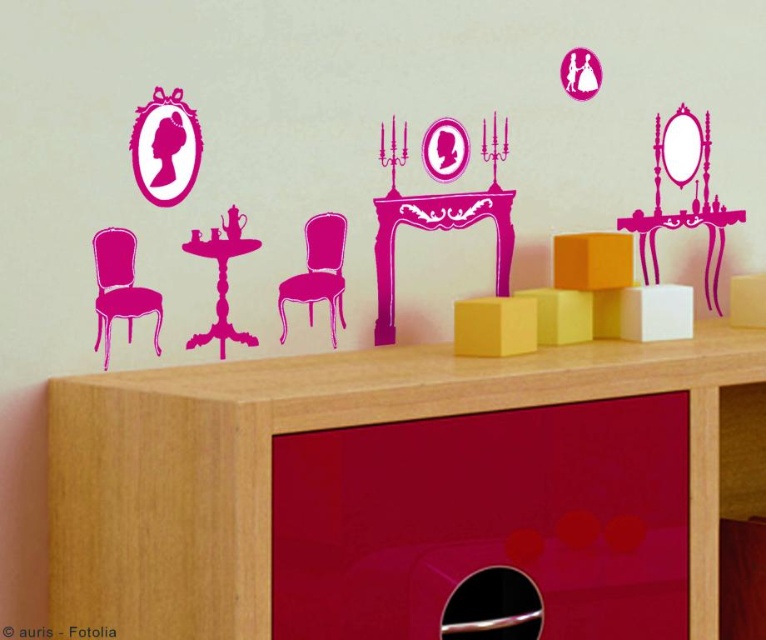
Which is above, pink glossy chair at center or pink glossy table at center?

pink glossy chair at center is higher up.

Is point (326, 268) less distant than point (182, 244)?

That is False.

Where is `pink glossy chair at center`? Image resolution: width=766 pixels, height=640 pixels. pink glossy chair at center is located at coordinates (318, 273).

Between wooden dresser at lower center and matte pink chair at left, which one is positioned lower?

wooden dresser at lower center is below.

Between wooden dresser at lower center and matte pink chair at left, which one has less height?

matte pink chair at left

Which is behind, point (388, 468) or point (100, 275)?

Point (100, 275)

Find the location of `wooden dresser at lower center`. wooden dresser at lower center is located at coordinates (393, 490).

Who is lower down, pink glossy vanity table at center or pink glossy chair at center?

pink glossy chair at center

Which is behind, point (388, 208) or point (316, 257)?

The point (388, 208) is behind.

Is point (509, 241) closer to camera compared to point (326, 275)?

No, it is behind (326, 275).

This screenshot has width=766, height=640. Identify the location of pink glossy vanity table at center. (x=436, y=228).